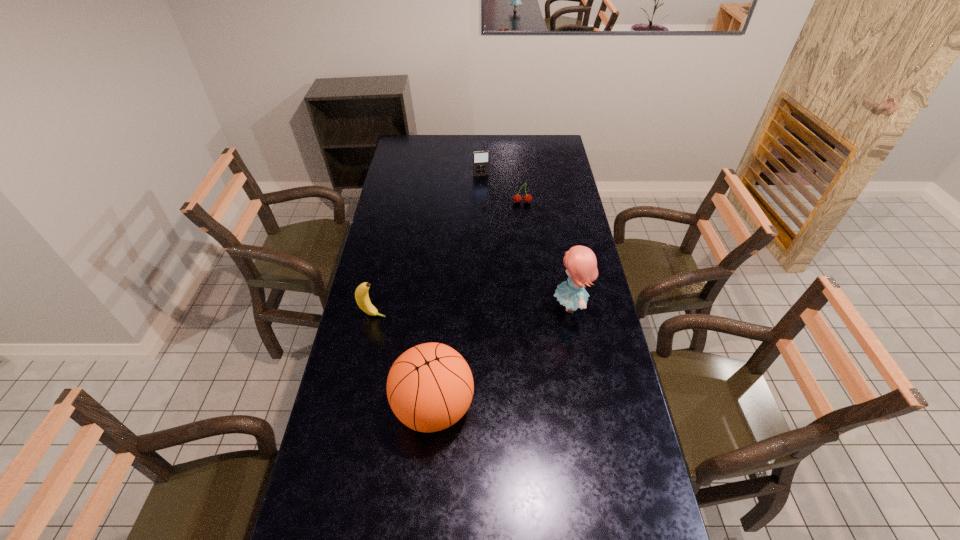
The image size is (960, 540). I want to click on free spot between the second farthest object and the rightmost object, so click(x=546, y=254).

Where is `unoccupied area between the fourth shortest object and the doll`? The width and height of the screenshot is (960, 540). unoccupied area between the fourth shortest object and the doll is located at coordinates (502, 357).

The height and width of the screenshot is (540, 960). What are the coordinates of `vacant area that lies between the fourth shortest object and the farthest object` in the screenshot? It's located at (457, 291).

At what (x,y) coordinates should I click in order to perform the action: click on vacant area between the nearest object and the rightmost object. Please return your answer as a coordinate pair (x, y). This screenshot has height=540, width=960. Looking at the image, I should click on (502, 357).

Identify the location of empty location between the rightmost object and the third tallest object. (472, 310).

Identify the location of vacant area between the farthest object and the nearest object. 457,291.

You are a GUI agent. You are given a task and a screenshot of the screen. Output one action in this format:
    pyautogui.click(x=<x>, y=<y>)
    Task: Click on the fourth closest object relative to the basketball
    Image resolution: width=960 pixels, height=540 pixels.
    Given the screenshot: What is the action you would take?
    pyautogui.click(x=480, y=158)

Identify the location of object that is the closest to the basketball. Image resolution: width=960 pixels, height=540 pixels. (361, 294).

The image size is (960, 540). I want to click on blank area in the image that satisfies the following two spatial constraints: 1. on the front side of the doll; 2. on the front-facing side of the farthest object, so click(481, 306).

Locate an element on the screen. vacant space that satisfies the following two spatial constraints: 1. on the back side of the doll; 2. on the front-facing side of the basketball is located at coordinates (442, 306).